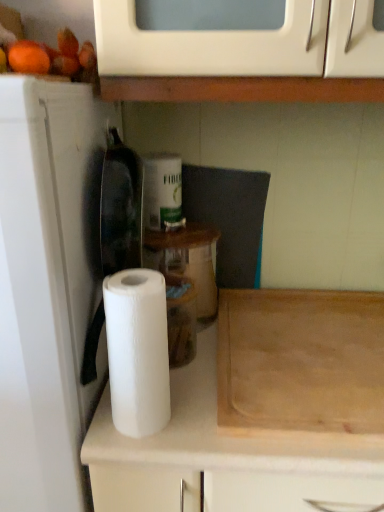
Question: In the image, is white matte paper towel at center on the left side or the right side of wooden cutting board at lower right?

Choices:
 (A) right
 (B) left

Answer: (B)

Question: Is white matte paper towel at center wider or thinner than wooden cutting board at lower right?

Choices:
 (A) wide
 (B) thin

Answer: (B)

Question: Estimate the real-world distances between objects in this image. Which object is farther from the wooden cutting board at lower right?

Choices:
 (A) white matte paper towel at center
 (B) white matte paper towel roll at center
 (C) white paper towel at left

Answer: (C)

Question: Which is farther from the white matte paper towel roll at center?

Choices:
 (A) white paper towel at left
 (B) white matte paper towel at center
 (C) wooden cutting board at lower right

Answer: (A)